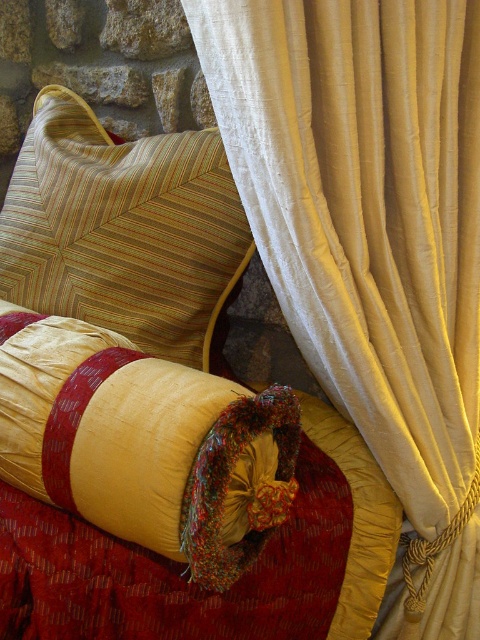
Does silky cream curtain at upper right appear on the left side of striped fabric cushion at upper left?

No, silky cream curtain at upper right is not to the left of striped fabric cushion at upper left.

Which is in front, point (459, 467) or point (186, 312)?

Positioned in front is point (459, 467).

Where is `silky cream curtain at upper right`? The height and width of the screenshot is (640, 480). silky cream curtain at upper right is located at coordinates (372, 244).

Can you confirm if silky cream curtain at upper right is wider than velvet gold throw pillow at center?

Incorrect, silky cream curtain at upper right's width does not surpass velvet gold throw pillow at center's.

Which is in front, point (465, 506) or point (208, 419)?

Point (208, 419) is in front.

Where is `silky cream curtain at upper right`? The height and width of the screenshot is (640, 480). silky cream curtain at upper right is located at coordinates (372, 244).

Is velvet gold throw pillow at center to the left of striped fabric cushion at upper left from the viewer's perspective?

In fact, velvet gold throw pillow at center is to the right of striped fabric cushion at upper left.

Between point (181, 448) and point (100, 179), which one is positioned in front?

Positioned in front is point (181, 448).

Describe the element at coordinates (144, 444) in the screenshot. I see `velvet gold throw pillow at center` at that location.

At what (x,y) coordinates should I click in order to perform the action: click on velvet gold throw pillow at center. Please return your answer as a coordinate pair (x, y). Looking at the image, I should click on (144, 444).